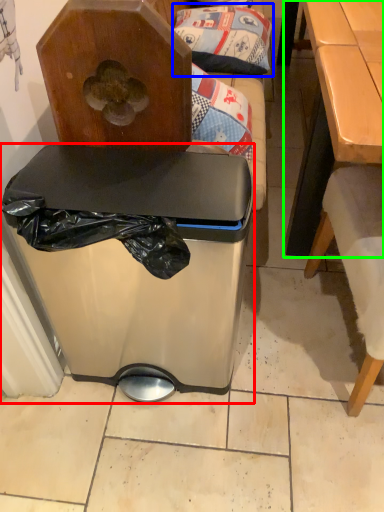
Question: Based on their relative distances, which object is nearer to trash bin/can (highlighted by a red box)? Choose from pillow (highlighted by a blue box) and table (highlighted by a green box).

Choices:
 (A) pillow
 (B) table

Answer: (B)